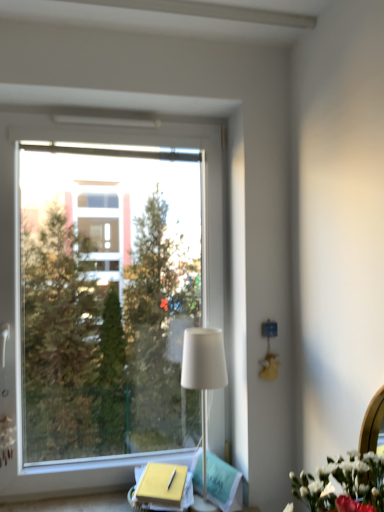
Question: Relative to white fabric lampshade at center, is transparent glass window at left in front or behind?

Choices:
 (A) behind
 (B) front

Answer: (A)

Question: Considering the relative positions of transparent glass window at left and white fabric lampshade at center in the image provided, is transparent glass window at left to the left or to the right of white fabric lampshade at center?

Choices:
 (A) left
 (B) right

Answer: (A)

Question: Is transparent glass window at left taller or shorter than white fabric lampshade at center?

Choices:
 (A) short
 (B) tall

Answer: (B)

Question: Considering the positions of point (200, 373) and point (14, 117), is point (200, 373) closer or farther from the camera than point (14, 117)?

Choices:
 (A) farther
 (B) closer

Answer: (B)

Question: From the image's perspective, relative to transparent glass window at left, is white fabric lampshade at center above or below?

Choices:
 (A) above
 (B) below

Answer: (B)

Question: Based on their positions, is white fabric lampshade at center located to the left or right of transparent glass window at left?

Choices:
 (A) right
 (B) left

Answer: (A)

Question: Is white fabric lampshade at center wider or thinner than transparent glass window at left?

Choices:
 (A) wide
 (B) thin

Answer: (A)